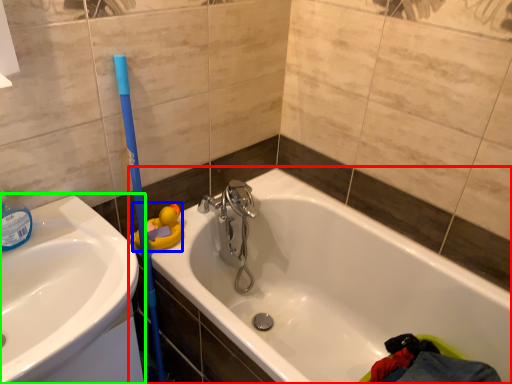
Question: Estimate the real-world distances between objects in this image. Which object is farther from bathtub (highlighted by a red box), toy (highlighted by a blue box) or sink (highlighted by a green box)?

Choices:
 (A) toy
 (B) sink

Answer: (B)